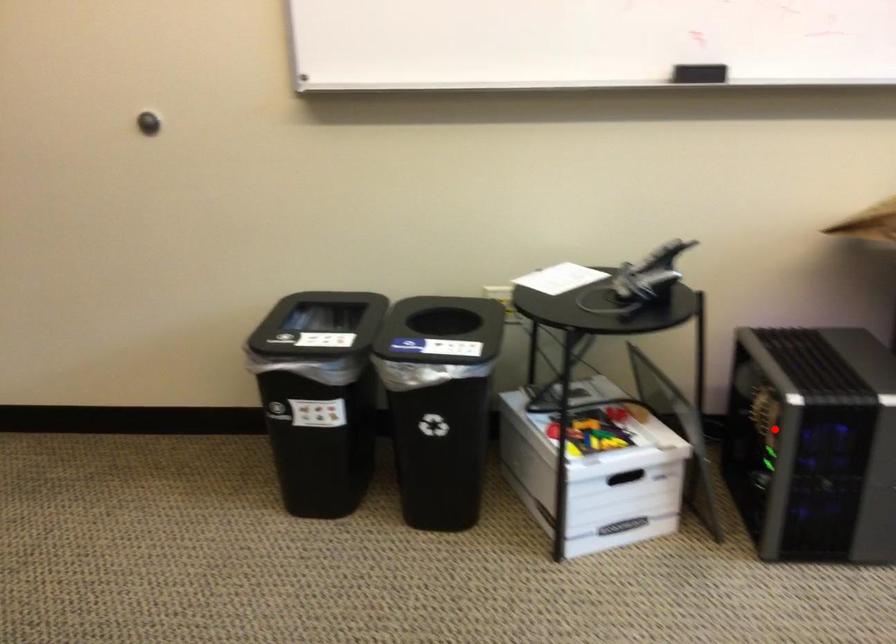
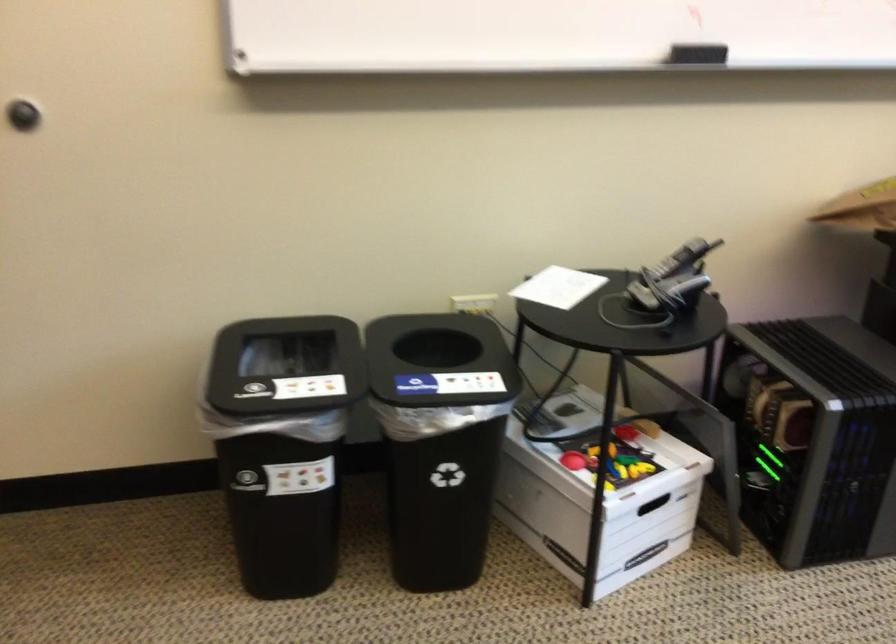
Find the pixel in the second image that matches the highlighted location in the first image.

(813, 436)